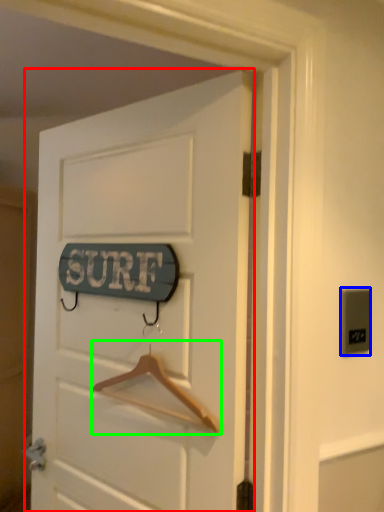
Question: Based on their relative distances, which object is nearer to door (highlighted by a red box)? Choose from electric outlet (highlighted by a blue box) and hanger (highlighted by a green box).

Choices:
 (A) electric outlet
 (B) hanger

Answer: (B)